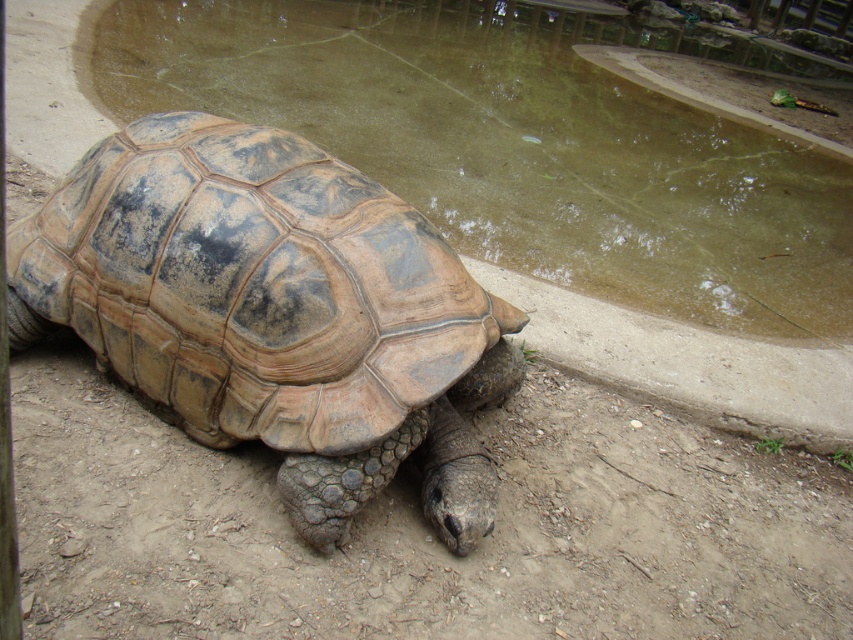
Question: Observing the image, what is the correct spatial positioning of brown textured concrete at lower left in reference to brown textured shell at center?

Choices:
 (A) right
 (B) left

Answer: (A)

Question: Does brown textured concrete at lower left come behind brown textured shell at center?

Choices:
 (A) yes
 (B) no

Answer: (A)

Question: Can you confirm if brown textured concrete at lower left is positioned to the left of brown textured shell at center?

Choices:
 (A) yes
 (B) no

Answer: (B)

Question: Which point is farther to the camera?

Choices:
 (A) brown textured concrete at lower left
 (B) brown textured shell at center

Answer: (A)

Question: Which point is closer to the camera taking this photo?

Choices:
 (A) (408, 269)
 (B) (195, 51)

Answer: (A)

Question: Which of the following is the closest to the observer?

Choices:
 (A) brown textured concrete at lower left
 (B) brown textured shell at center

Answer: (B)